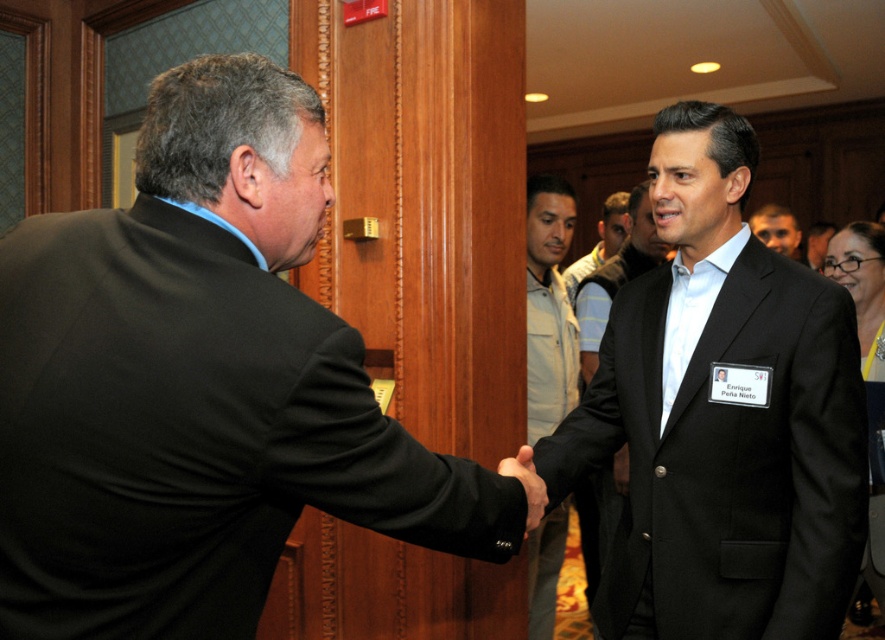
You are a photographer setting up for a formal event. You notice the black matte suit at left and the light brown leather jacket at center. Which of these two items is wider?

The black matte suit at left is wider than the light brown leather jacket at center.